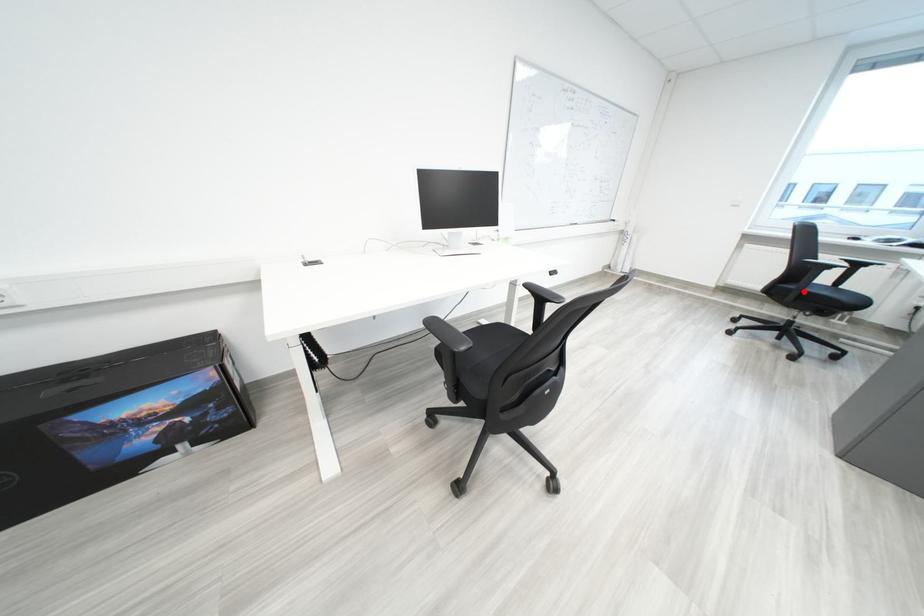
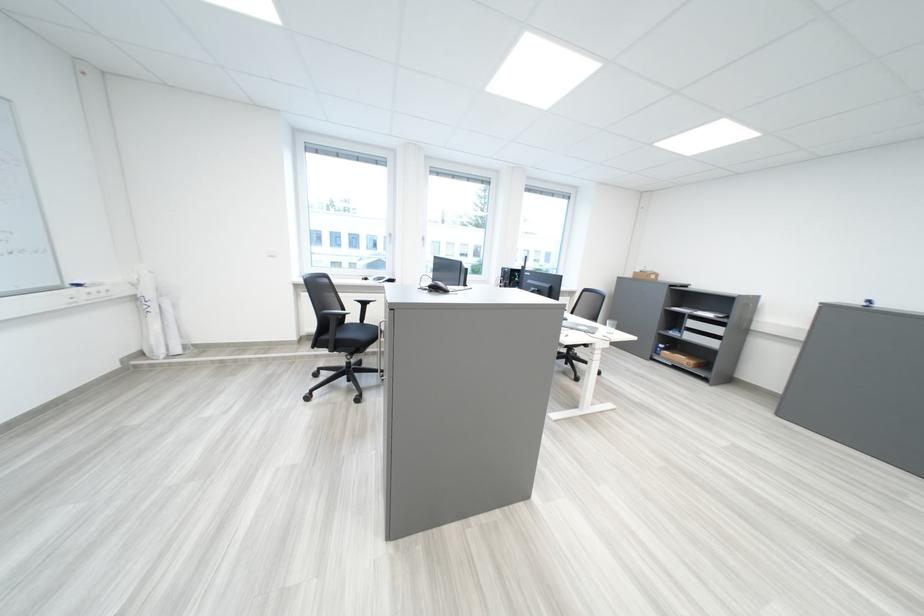
Locate, in the second image, the point that corresponds to the highlighted location in the first image.

(341, 342)